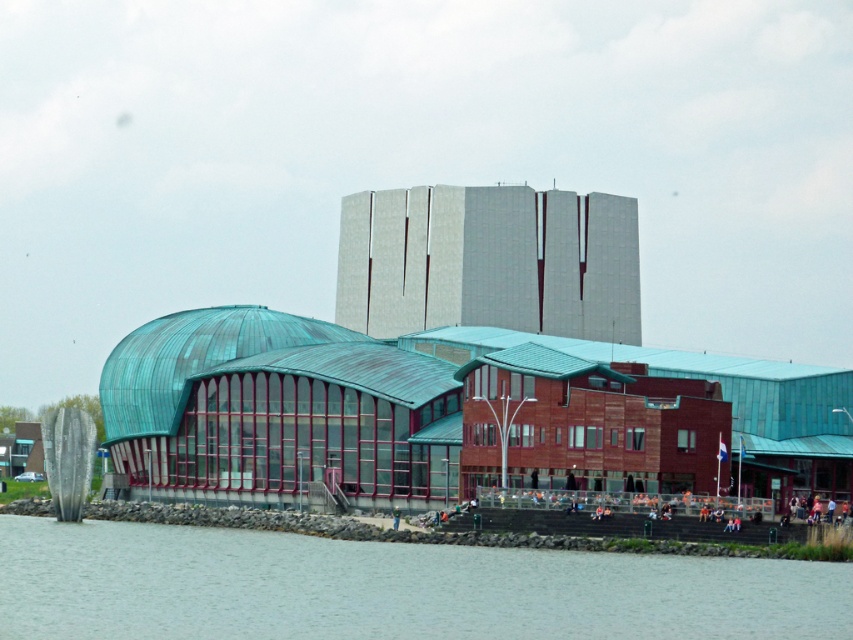
Question: Is gray concrete river at lower left smaller than smooth concrete tower at upper center?

Choices:
 (A) no
 (B) yes

Answer: (A)

Question: Which point appears closest to the camera in this image?

Choices:
 (A) (529, 285)
 (B) (279, 563)

Answer: (B)

Question: Is gray concrete river at lower left positioned at the back of smooth concrete tower at upper center?

Choices:
 (A) no
 (B) yes

Answer: (A)

Question: Which point appears closest to the camera in this image?

Choices:
 (A) (560, 268)
 (B) (474, 625)

Answer: (B)

Question: Can you confirm if gray concrete river at lower left is positioned above smooth concrete tower at upper center?

Choices:
 (A) no
 (B) yes

Answer: (A)

Question: Which point is farther to the camera?

Choices:
 (A) (321, 628)
 (B) (440, 288)

Answer: (B)